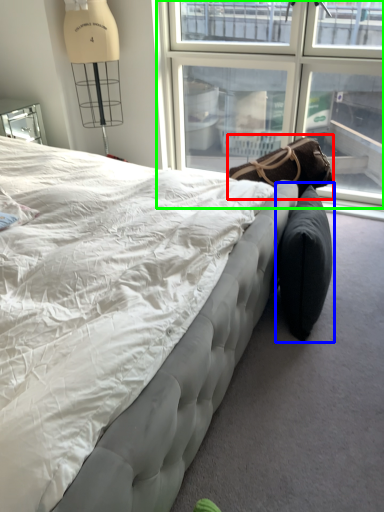
Question: Which object is the farthest from bean bag chair (highlighted by a red box)? Choose among these: bean bag chair (highlighted by a blue box) or window (highlighted by a green box).

Choices:
 (A) bean bag chair
 (B) window

Answer: (B)